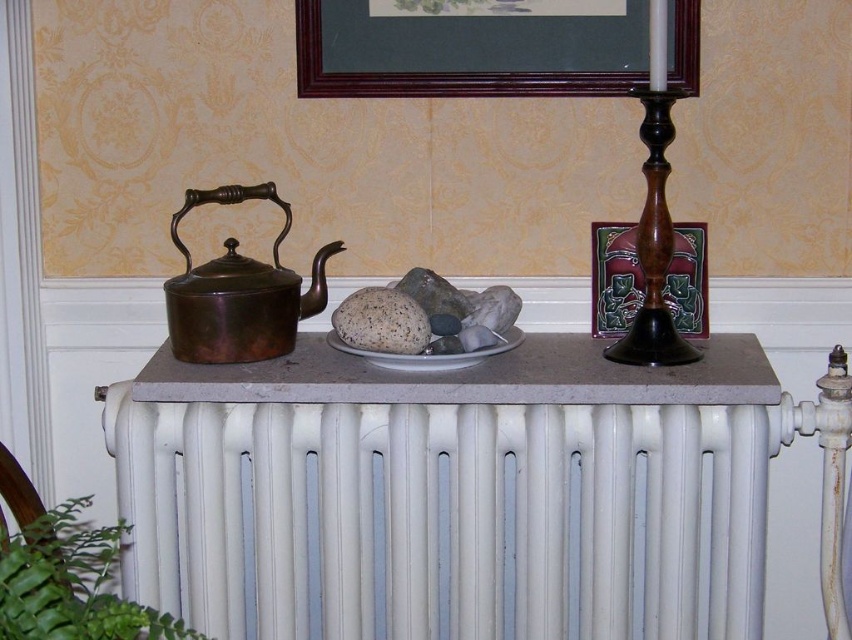
Question: Which of these objects is positioned farthest from the white painted radiator at center?

Choices:
 (A) speckled stone at center
 (B) wooden picture frame at upper center
 (C) matte wooden candlestick at right
 (D) wooden candlestick at right

Answer: (B)

Question: Can you confirm if wooden candlestick at right is wider than matte wooden candlestick at right?

Choices:
 (A) yes
 (B) no

Answer: (B)

Question: Which of these objects is positioned closest to the bronze metallic teapot at left?

Choices:
 (A) white painted radiator at center
 (B) speckled stone at center
 (C) wooden candlestick at right
 (D) white ceramic plate at center

Answer: (B)

Question: Which of the following is the farthest from the observer?

Choices:
 (A) bronze metallic teapot at left
 (B) wooden picture frame at upper center
 (C) white painted radiator at center
 (D) matte wooden candlestick at right

Answer: (D)

Question: From the image, what is the correct spatial relationship of bronze metallic teapot at left in relation to matte wooden candlestick at right?

Choices:
 (A) left
 (B) right

Answer: (A)

Question: Does white painted radiator at center have a lesser width compared to bronze metallic teapot at left?

Choices:
 (A) no
 (B) yes

Answer: (A)